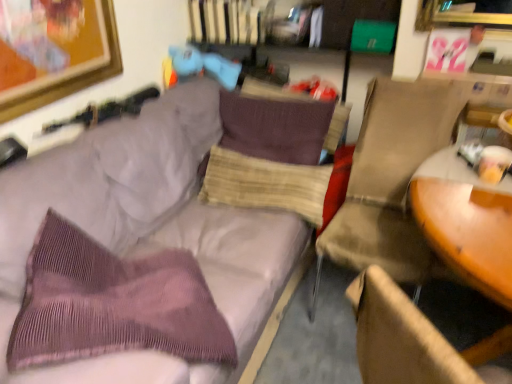
Question: From the image's perspective, would you say matte blue plush at upper center is shown under purple corduroy couch at upper left?

Choices:
 (A) yes
 (B) no

Answer: (B)

Question: From the image's perspective, is matte blue plush at upper center on purple corduroy couch at upper left?

Choices:
 (A) no
 (B) yes

Answer: (B)

Question: Is matte blue plush at upper center turned away from purple corduroy couch at upper left?

Choices:
 (A) no
 (B) yes

Answer: (A)

Question: Considering the relative sizes of matte blue plush at upper center and purple corduroy couch at upper left in the image provided, is matte blue plush at upper center bigger than purple corduroy couch at upper left?

Choices:
 (A) no
 (B) yes

Answer: (A)

Question: Is matte blue plush at upper center thinner than purple corduroy couch at upper left?

Choices:
 (A) no
 (B) yes

Answer: (B)

Question: Is purple corduroy pillow at center, the second pillow from the bottom, spatially inside beige fabric chair at right, or outside of it?

Choices:
 (A) inside
 (B) outside

Answer: (B)

Question: In the image, is purple corduroy pillow at center, the second pillow from the bottom, positioned in front of or behind beige fabric chair at right?

Choices:
 (A) behind
 (B) front

Answer: (A)

Question: Is purple corduroy pillow at center, the second pillow from the bottom, wider or thinner than beige fabric chair at right?

Choices:
 (A) thin
 (B) wide

Answer: (A)

Question: From their relative heights in the image, would you say purple corduroy pillow at center, marked as the 1th pillow in a top-to-bottom arrangement, is taller or shorter than beige fabric chair at right?

Choices:
 (A) short
 (B) tall

Answer: (A)

Question: Is beige textured pillow at center, the 2th pillow when ordered from top to bottom, taller or shorter than purple corduroy pillow at center, marked as the 1th pillow in a top-to-bottom arrangement?

Choices:
 (A) short
 (B) tall

Answer: (A)

Question: Based on their sizes in the image, would you say beige textured pillow at center, which is counted as the first pillow, starting from the bottom, is bigger or smaller than purple corduroy pillow at center, the second pillow from the bottom?

Choices:
 (A) small
 (B) big

Answer: (A)

Question: From a real-world perspective, is beige textured pillow at center, the 2th pillow when ordered from top to bottom, positioned above or below purple corduroy pillow at center, marked as the 1th pillow in a top-to-bottom arrangement?

Choices:
 (A) above
 (B) below

Answer: (B)

Question: Based on their positions, is beige textured pillow at center, which is counted as the first pillow, starting from the bottom, located to the left or right of purple corduroy pillow at center, marked as the 1th pillow in a top-to-bottom arrangement?

Choices:
 (A) right
 (B) left

Answer: (B)

Question: Considering the positions of point (109, 339) and point (471, 231), is point (109, 339) closer or farther from the camera than point (471, 231)?

Choices:
 (A) farther
 (B) closer

Answer: (B)

Question: Is purple corduroy throw pillow at left spatially inside wooden round table at right, or outside of it?

Choices:
 (A) outside
 (B) inside

Answer: (A)